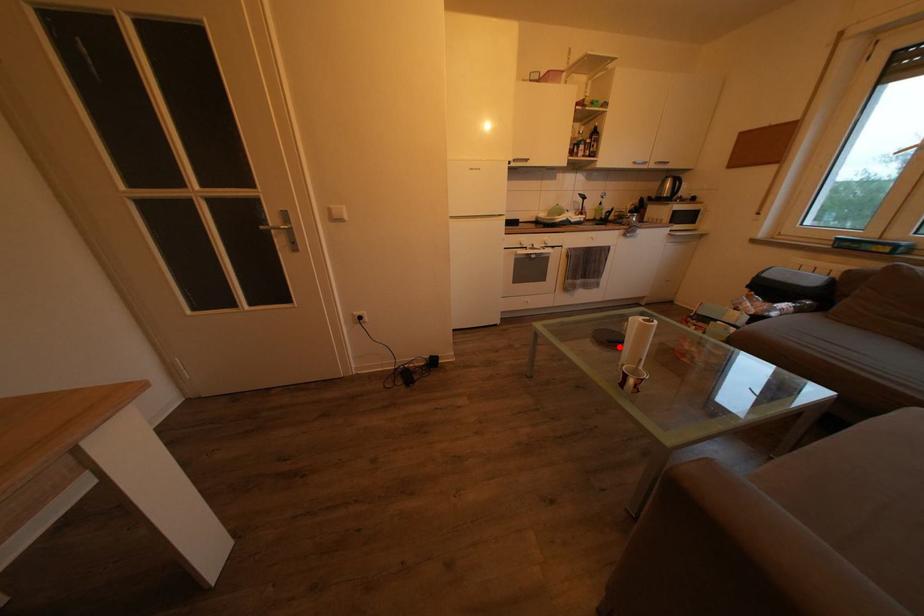
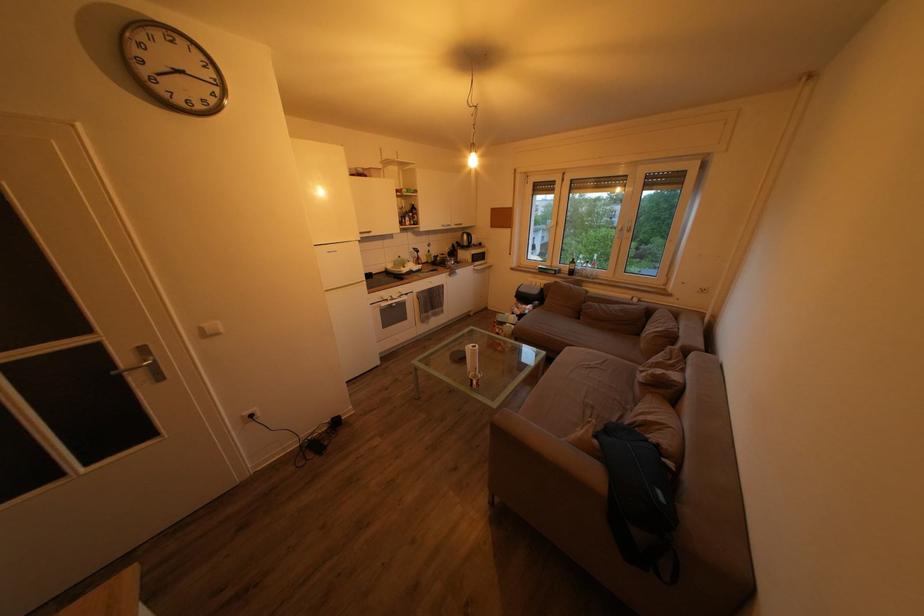
In the second image, find the point that corresponds to the highlighted location in the first image.

(468, 365)